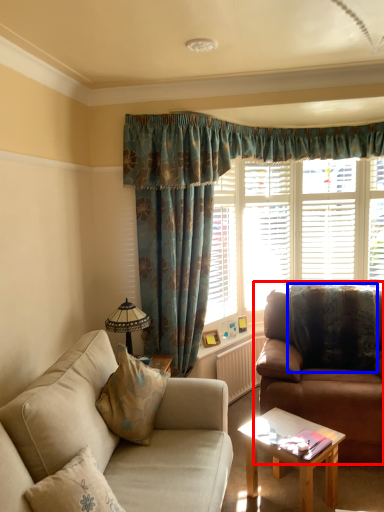
Question: Which object is further to the camera taking this photo, studio couch (highlighted by a red box) or pillow (highlighted by a blue box)?

Choices:
 (A) studio couch
 (B) pillow

Answer: (B)